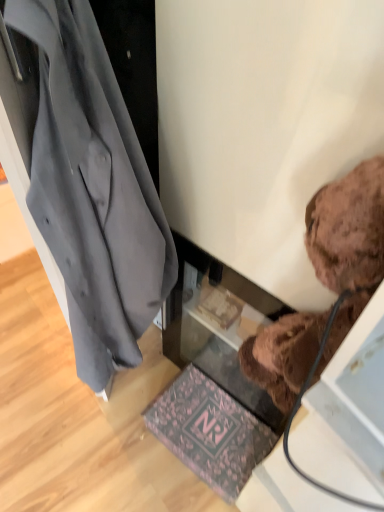
What do you see at coordinates (348, 242) in the screenshot? I see `brown plush teddy bear at upper right` at bounding box center [348, 242].

I want to click on dark gray fabric coat at left, so click(93, 190).

From a real-world perspective, is dark gray fabric coat at left over brown plush teddy bear at upper right?

Actually, dark gray fabric coat at left is physically below brown plush teddy bear at upper right in the real world.

Is point (108, 70) closer or farther from the camera than point (264, 362)?

Point (108, 70) is closer to the camera than point (264, 362).

What's the angular difference between dark gray fabric coat at left and brown plush teddy bear at upper right's facing directions?

The angular difference between dark gray fabric coat at left and brown plush teddy bear at upper right is 5.41 degrees.

From the image's perspective, does dark gray fabric coat at left appear lower than brown plush teddy bear at upper right?

No, from the image's perspective, dark gray fabric coat at left is not below brown plush teddy bear at upper right.

Which object is more forward, brown plush teddy bear at upper right or dark gray fabric coat at left?

brown plush teddy bear at upper right.

From the picture: Is brown plush teddy bear at upper right bigger or smaller than dark gray fabric coat at left?

In the image, brown plush teddy bear at upper right appears to be smaller than dark gray fabric coat at left.

Is point (292, 405) farther from viewer compared to point (86, 222)?

Yes, it is.

Which is nearer, [273,435] or [352,217]?

The point [352,217] is closer to the camera.

How many degrees apart are the facing directions of pink floral mat at lower center and brown plush teddy bear at upper right?

They differ by 1.72 degrees in their facing directions.

Between pink floral mat at lower center and brown plush teddy bear at upper right, which one has larger width?

With larger width is pink floral mat at lower center.

From the image's perspective, which is below, dark gray fabric coat at left or pink floral mat at lower center?

pink floral mat at lower center appears lower in the image.

Can you confirm if dark gray fabric coat at left is taller than pink floral mat at lower center?

Yes.

What's the angular difference between dark gray fabric coat at left and pink floral mat at lower center's facing directions?

3.69 degrees separate the facing orientations of dark gray fabric coat at left and pink floral mat at lower center.

Locate an element on the screen. The image size is (384, 512). mat that is on the right side of dark gray fabric coat at left is located at coordinates point(209,431).

Is brown plush teddy bear at upper right looking in the opposite direction of pink floral mat at lower center?

No, brown plush teddy bear at upper right is not facing the opposite direction of pink floral mat at lower center.

From a real-world perspective, is brown plush teddy bear at upper right physically located above or below pink floral mat at lower center?

Clearly, from a real-world perspective, brown plush teddy bear at upper right is above pink floral mat at lower center.

Based on the photo, considering the relative sizes of brown plush teddy bear at upper right and pink floral mat at lower center in the image provided, is brown plush teddy bear at upper right wider than pink floral mat at lower center?

In fact, brown plush teddy bear at upper right might be narrower than pink floral mat at lower center.

In the scene shown: From a real-world perspective, who is located higher, pink floral mat at lower center or dark gray fabric coat at left?

dark gray fabric coat at left is physically above.

Considering the relative sizes of pink floral mat at lower center and dark gray fabric coat at left in the image provided, is pink floral mat at lower center taller than dark gray fabric coat at left?

No, pink floral mat at lower center is not taller than dark gray fabric coat at left.

Can you confirm if pink floral mat at lower center is positioned to the left of dark gray fabric coat at left?

No, pink floral mat at lower center is not to the left of dark gray fabric coat at left.

This screenshot has height=512, width=384. Identify the location of coat above the brown plush teddy bear at upper right (from the image's perspective). (93, 190).

The width and height of the screenshot is (384, 512). In order to click on coat on the left of the brown plush teddy bear at upper right in this screenshot , I will do `click(93, 190)`.

Which object lies further to the anchor point brown plush teddy bear at upper right, pink floral mat at lower center or dark gray fabric coat at left?

pink floral mat at lower center is further to brown plush teddy bear at upper right.

Based on their spatial positions, is dark gray fabric coat at left or pink floral mat at lower center further from brown plush teddy bear at upper right?

The object further to brown plush teddy bear at upper right is pink floral mat at lower center.

Considering their positions, is brown plush teddy bear at upper right positioned closer to dark gray fabric coat at left than pink floral mat at lower center?

The object closer to dark gray fabric coat at left is brown plush teddy bear at upper right.

Looking at this image, based on their spatial positions, is dark gray fabric coat at left or brown plush teddy bear at upper right closer to pink floral mat at lower center?

The object closer to pink floral mat at lower center is dark gray fabric coat at left.

Based on their spatial positions, is pink floral mat at lower center or brown plush teddy bear at upper right closer to dark gray fabric coat at left?

brown plush teddy bear at upper right is closer to dark gray fabric coat at left.

Estimate the real-world distances between objects in this image. Which object is closer to pink floral mat at lower center, brown plush teddy bear at upper right or dark gray fabric coat at left?

dark gray fabric coat at left lies closer to pink floral mat at lower center than the other object.

Locate an element on the screen. coat located between brown plush teddy bear at upper right and pink floral mat at lower center in the depth direction is located at coordinates (93, 190).